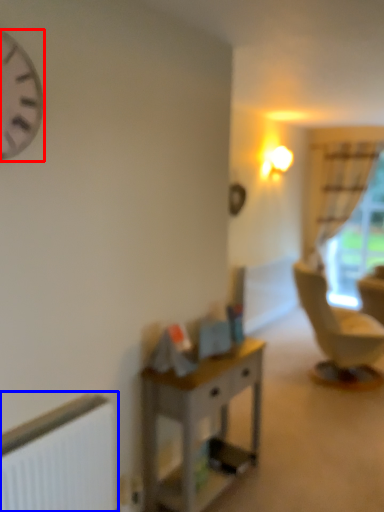
Question: Which object is closer to the camera taking this photo, clock (highlighted by a red box) or radiator (highlighted by a blue box)?

Choices:
 (A) clock
 (B) radiator

Answer: (A)